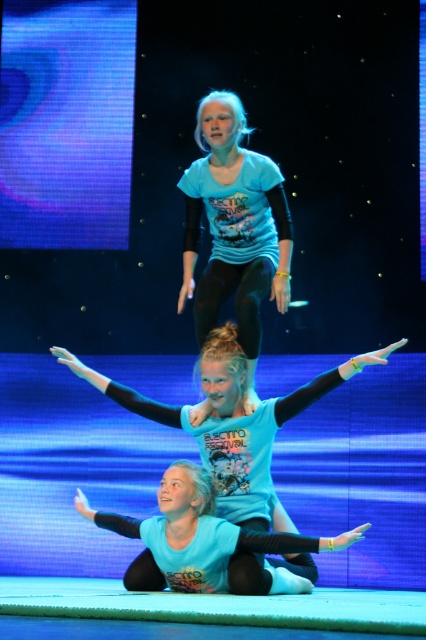
Is matte blue leotard at center to the left of matte blue t-shirt at center from the viewer's perspective?

Yes, matte blue leotard at center is to the left of matte blue t-shirt at center.

Between matte blue leotard at center and matte blue t-shirt at center, which one appears on the left side from the viewer's perspective?

matte blue leotard at center is more to the left.

Does point (282, 400) lie behind point (250, 212)?

No.

At what (x,y) coordinates should I click in order to perform the action: click on matte blue leotard at center. Please return your answer as a coordinate pair (x, y). This screenshot has width=426, height=640. Looking at the image, I should click on (224, 465).

Can you confirm if matte blue leotard at center is positioned to the left of matte blue leggings at lower center?

Yes, matte blue leotard at center is to the left of matte blue leggings at lower center.

Does matte blue leotard at center have a lesser width compared to matte blue leggings at lower center?

Incorrect, matte blue leotard at center's width is not less than matte blue leggings at lower center's.

Is point (245, 472) positioned after point (305, 548)?

Yes, point (245, 472) is farther from viewer.

Where is `matte blue leotard at center`? matte blue leotard at center is located at coordinates (224, 465).

Which of these two, matte blue t-shirt at center or matte blue leggings at lower center, stands taller?

matte blue t-shirt at center

Which is behind, point (227, 186) or point (275, 577)?

Point (227, 186)

Locate an element on the screen. The height and width of the screenshot is (640, 426). matte blue t-shirt at center is located at coordinates (235, 228).